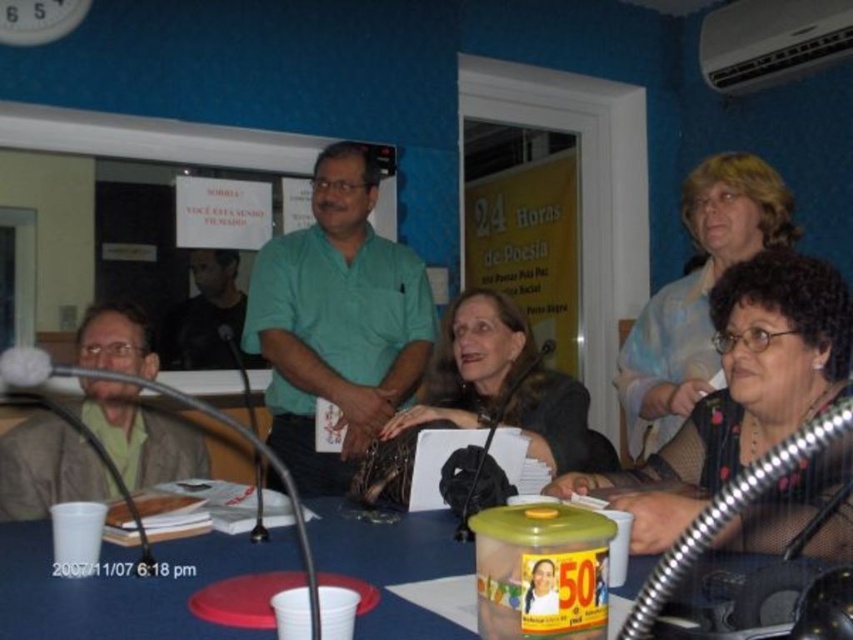
Can you confirm if green cotton shirt at center is bigger than matte black jacket at center?

Yes.

Does point (412, 371) come farther from viewer compared to point (569, 428)?

Yes.

This screenshot has width=853, height=640. I want to click on green cotton shirt at center, so click(x=337, y=321).

Who is positioned more to the left, green cotton shirt at center or blue plastic table at center?

blue plastic table at center

Looking at this image, can you confirm if green cotton shirt at center is wider than blue plastic table at center?

Incorrect, green cotton shirt at center's width does not surpass blue plastic table at center's.

Locate an element on the screen. green cotton shirt at center is located at coordinates (337, 321).

Image resolution: width=853 pixels, height=640 pixels. Identify the location of green cotton shirt at center. (337, 321).

Who is positioned more to the left, green cotton shirt at center or matte blue blouse at upper right?

green cotton shirt at center is more to the left.

Describe the element at coordinates (337, 321) in the screenshot. I see `green cotton shirt at center` at that location.

You are a GUI agent. You are given a task and a screenshot of the screen. Output one action in this format:
    pyautogui.click(x=<x>, y=<y>)
    Task: Click on the green cotton shirt at center
    Image resolution: width=853 pixels, height=640 pixels.
    Given the screenshot: What is the action you would take?
    pyautogui.click(x=337, y=321)